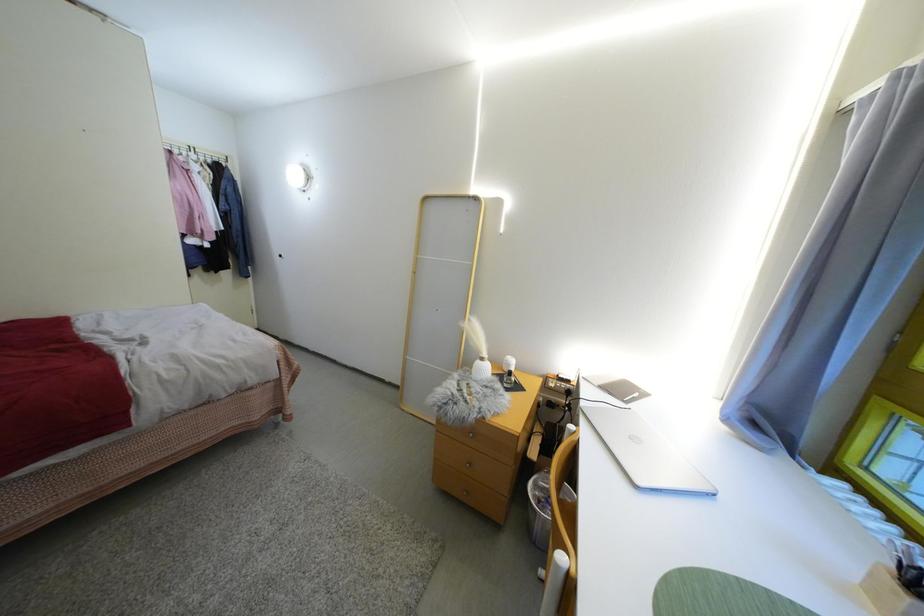
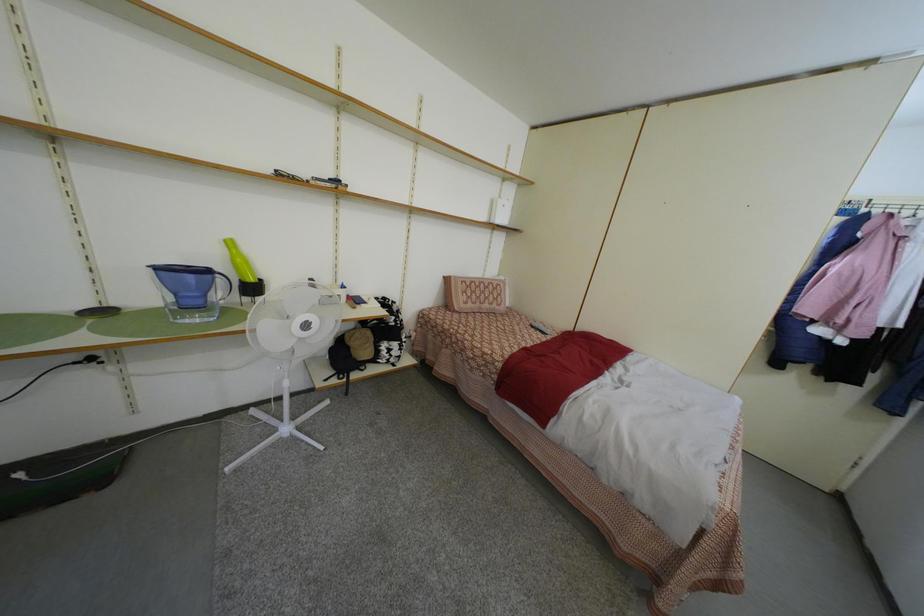
The images are taken continuously from a first-person perspective. In which direction is your viewpoint rotating?

The camera rotated toward left-down.